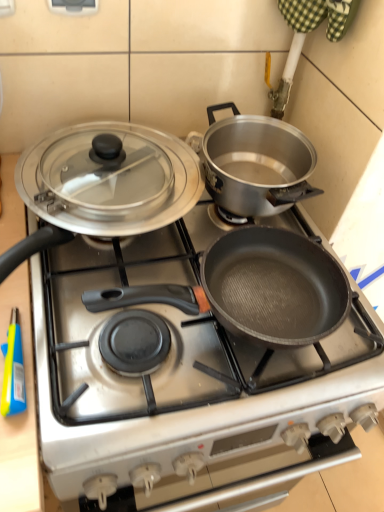
Question: Should I look upward or downward to see non-stick black pan at center?

Choices:
 (A) down
 (B) up

Answer: (A)

Question: From the image's perspective, is non-stick black pan at center below shiny silver lid at upper left?

Choices:
 (A) yes
 (B) no

Answer: (A)

Question: Is the position of non-stick black pan at center more distant than that of shiny silver lid at upper left?

Choices:
 (A) yes
 (B) no

Answer: (B)

Question: Is non-stick black pan at center at the right side of shiny silver lid at upper left?

Choices:
 (A) yes
 (B) no

Answer: (A)

Question: From a real-world perspective, is non-stick black pan at center below shiny silver lid at upper left?

Choices:
 (A) no
 (B) yes

Answer: (B)

Question: Is non-stick black pan at center located outside shiny silver lid at upper left?

Choices:
 (A) yes
 (B) no

Answer: (A)

Question: Is non-stick black pan at center shorter than shiny silver lid at upper left?

Choices:
 (A) yes
 (B) no

Answer: (B)

Question: From the image's perspective, is shiny silver lid at upper left located above non-stick black pan at center?

Choices:
 (A) yes
 (B) no

Answer: (A)

Question: Considering the relative sizes of shiny silver lid at upper left and non-stick black pan at center in the image provided, is shiny silver lid at upper left thinner than non-stick black pan at center?

Choices:
 (A) yes
 (B) no

Answer: (A)

Question: From a real-world perspective, is shiny silver lid at upper left beneath non-stick black pan at center?

Choices:
 (A) no
 (B) yes

Answer: (A)

Question: From a real-world perspective, does shiny silver lid at upper left stand above non-stick black pan at center?

Choices:
 (A) yes
 (B) no

Answer: (A)

Question: Is shiny silver lid at upper left at the left side of non-stick black pan at center?

Choices:
 (A) yes
 (B) no

Answer: (A)

Question: Could non-stick black pan at center be considered to be inside shiny silver lid at upper left?

Choices:
 (A) yes
 (B) no

Answer: (B)

Question: Considering the positions of non-stick black pan at center and shiny silver lid at upper left in the image, is non-stick black pan at center wider or thinner than shiny silver lid at upper left?

Choices:
 (A) thin
 (B) wide

Answer: (B)